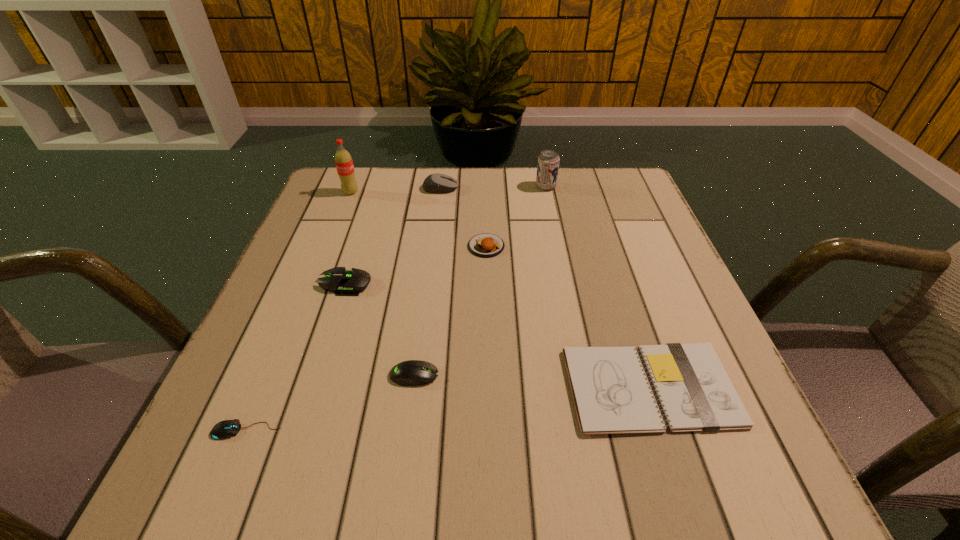
This screenshot has height=540, width=960. I want to click on free space at the left edge of the desktop, so click(353, 252).

The width and height of the screenshot is (960, 540). In the image, there is a desktop. Identify the location of free region at the right edge. (627, 308).

In the image, there is a desktop. Where is `vacant space at the far left corner`? Image resolution: width=960 pixels, height=540 pixels. vacant space at the far left corner is located at coordinates (360, 193).

Find the location of a particular element. Image resolution: width=960 pixels, height=540 pixels. empty space that is in between the nearest mouse and the notepad is located at coordinates (448, 409).

This screenshot has width=960, height=540. In order to click on free spot between the notepad and the fifth farthest object in this screenshot , I will do [x=498, y=336].

Locate an element on the screen. empty location between the second nearest mouse and the soda is located at coordinates (382, 284).

Where is `free point between the notepad and the tallest object`? free point between the notepad and the tallest object is located at coordinates (500, 290).

Image resolution: width=960 pixels, height=540 pixels. Identify the location of empty space between the tallest object and the sixth shortest object. (396, 190).

The height and width of the screenshot is (540, 960). Identify the location of free space between the second nearest mouse and the notepad. (533, 381).

Identify the location of unoccupied position between the tallest object and the tallest mouse. (396, 190).